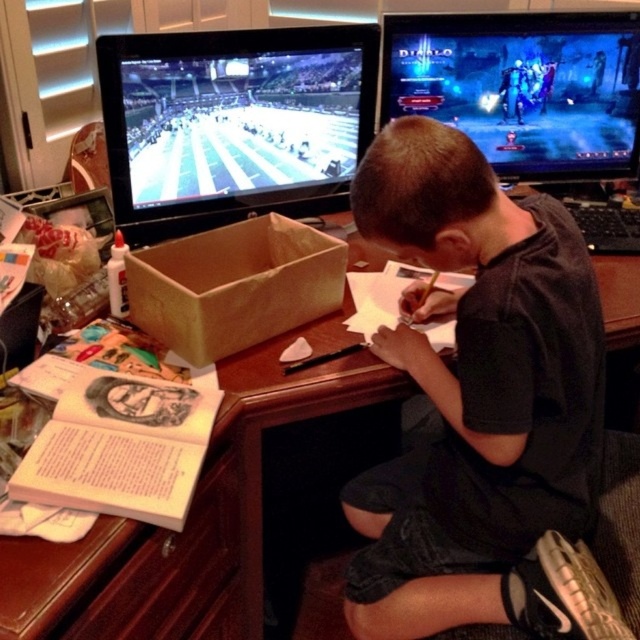
Question: Which point is farther to the camera?

Choices:
 (A) (225, 538)
 (B) (147, 278)
 (C) (531, 346)

Answer: (A)

Question: Which point is farther from the camera taking this photo?

Choices:
 (A) (234, 244)
 (B) (65, 572)

Answer: (A)

Question: Is the position of shiny plastic screen at upper left less distant than that of brown paper box at center?

Choices:
 (A) no
 (B) yes

Answer: (A)

Question: Which point is farther from the camera taking this photo?

Choices:
 (A) (492, 408)
 (B) (252, 355)
 (C) (301, 224)

Answer: (C)

Question: Is black cotton shirt at center bigger than shiny plastic screen at upper left?

Choices:
 (A) yes
 (B) no

Answer: (A)

Question: Does black cotton shirt at center lie in front of brown paper box at center?

Choices:
 (A) no
 (B) yes

Answer: (B)